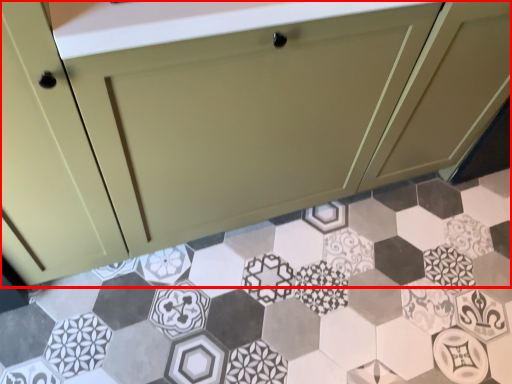
Question: From the image's perspective, what is the correct spatial positioning of cabinetry (annotated by the red box) in reference to porcelain?

Choices:
 (A) below
 (B) above

Answer: (B)